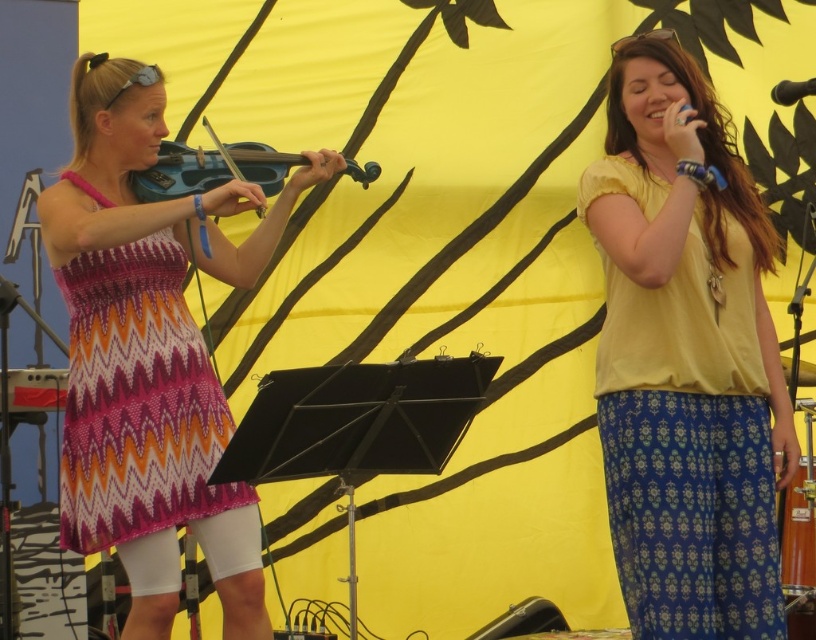
Question: Which object is closer to the camera taking this photo?

Choices:
 (A) matte blue violin at left
 (B) matte purple dress at left
 (C) yellow cotton shirt at upper right
 (D) black plastic microphone at upper right

Answer: (C)

Question: Can you confirm if matte blue violin at left is positioned above black plastic microphone at upper right?

Choices:
 (A) no
 (B) yes

Answer: (A)

Question: Estimate the real-world distances between objects in this image. Which object is farther from the yellow cotton shirt at upper right?

Choices:
 (A) black plastic microphone at upper right
 (B) pink zigzag knit dress at left

Answer: (A)

Question: From the image, what is the correct spatial relationship of yellow cotton shirt at upper right in relation to black plastic microphone at upper right?

Choices:
 (A) left
 (B) right

Answer: (A)

Question: Is matte purple dress at left positioned at the back of pink zigzag knit dress at left?

Choices:
 (A) yes
 (B) no

Answer: (B)

Question: Which object is farther from the camera taking this photo?

Choices:
 (A) black plastic microphone at upper right
 (B) matte purple dress at left
 (C) matte blue violin at left

Answer: (A)